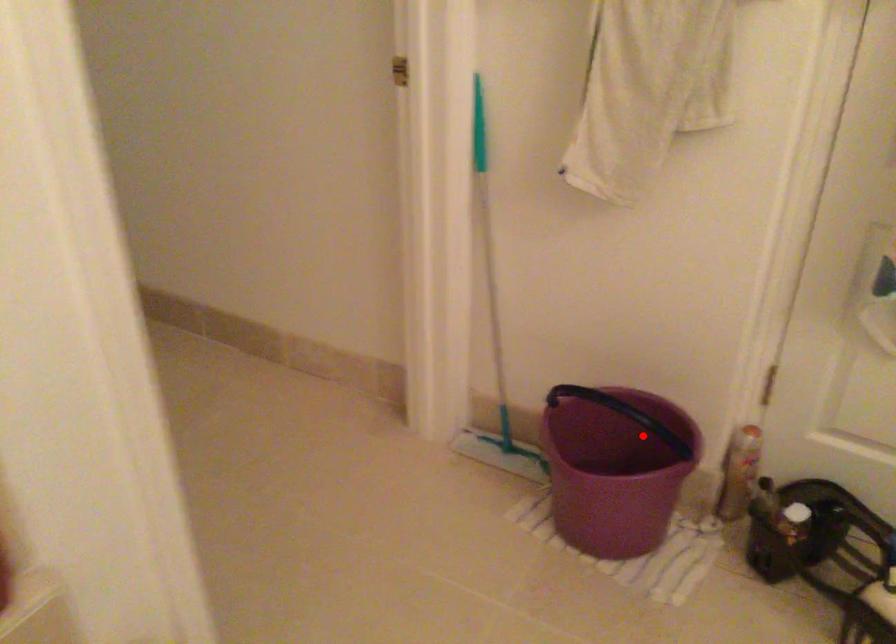
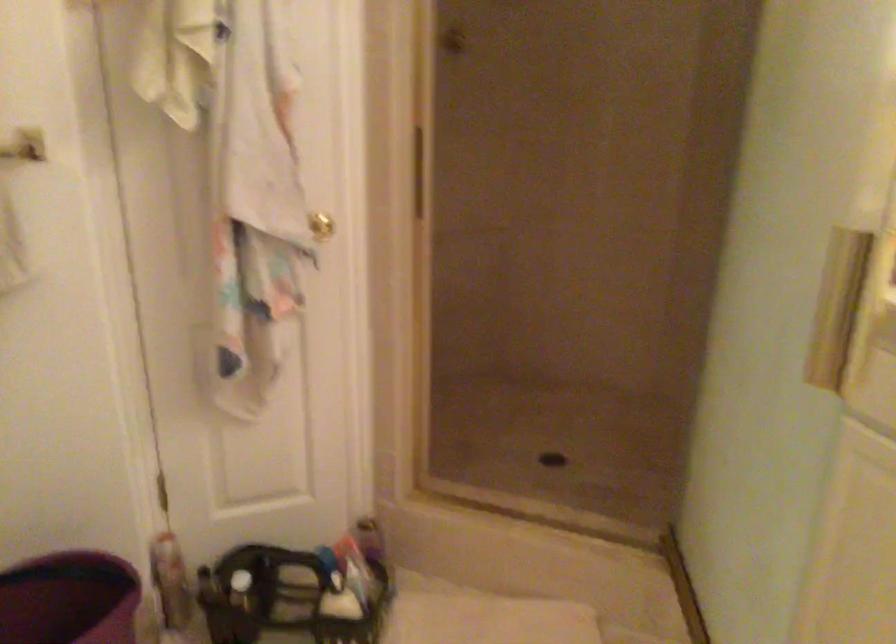
Find the pixel in the second image that matches the highlighted location in the first image.

(69, 599)